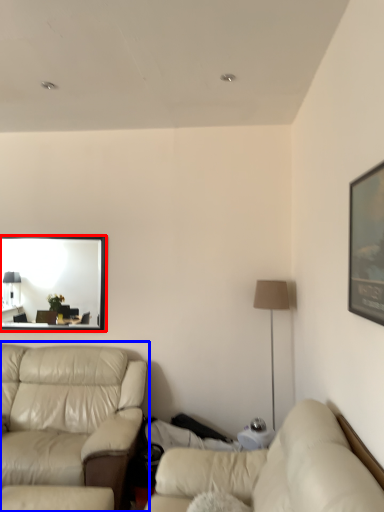
Question: Which object appears closest to the camera in this image, mirror (highlighted by a red box) or studio couch (highlighted by a blue box)?

Choices:
 (A) mirror
 (B) studio couch

Answer: (B)